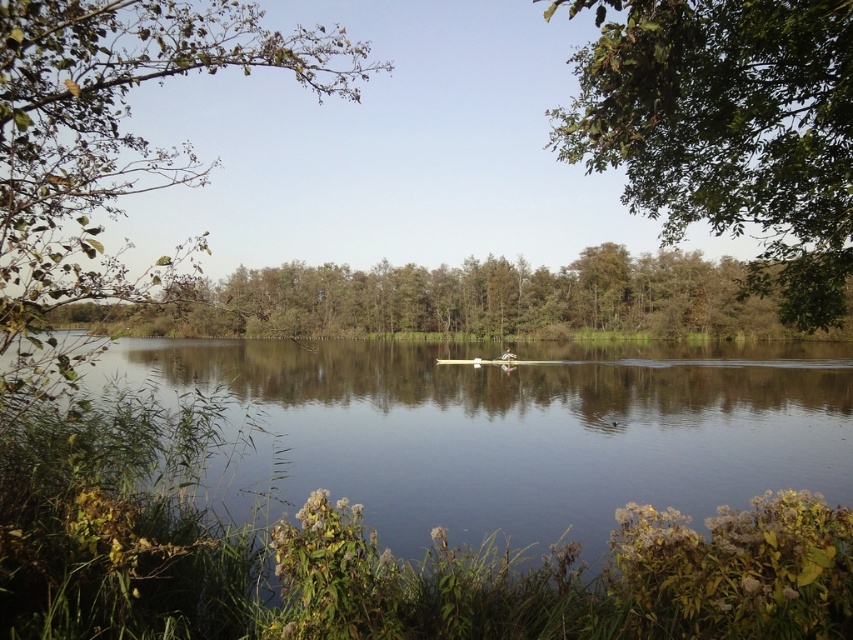
Who is positioned more to the left, green leafy tree at upper right or white plastic boat at center?

Positioned to the left is white plastic boat at center.

Is point (840, 145) less distant than point (512, 353)?

Yes, point (840, 145) is in front of point (512, 353).

You are a GUI agent. You are given a task and a screenshot of the screen. Output one action in this format:
    pyautogui.click(x=<x>, y=<y>)
    Task: Click on the green leafy tree at upper right
    
    Given the screenshot: What is the action you would take?
    pyautogui.click(x=727, y=129)

How far apart are clear water at center and green leafy branch at upper left?

They are 22.30 meters apart.

Does clear water at center lie in front of green leafy branch at upper left?

Yes, it is.

Which is behind, point (228, 401) or point (30, 390)?

The point (228, 401) is behind.

Identify the location of clear water at center. (506, 429).

Is point (751, 60) more distant than point (39, 8)?

That is True.

Which is behind, point (822, 54) or point (70, 173)?

Positioned behind is point (822, 54).

Does point (717, 49) lie behind point (36, 84)?

Yes, point (717, 49) is behind point (36, 84).

The height and width of the screenshot is (640, 853). Identify the location of green leafy tree at upper right. (727, 129).